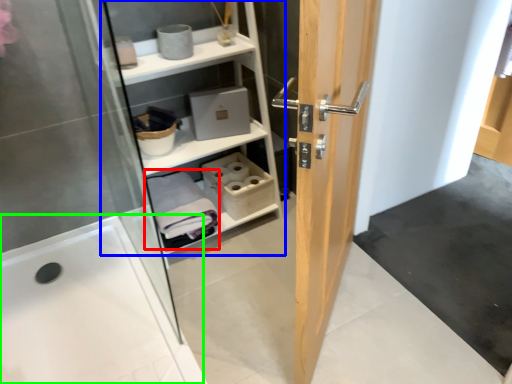
Question: Estimate the real-world distances between objects in this image. Which object is farther from bath towel (highlighted by a red box), shelf (highlighted by a blue box) or bath (highlighted by a green box)?

Choices:
 (A) shelf
 (B) bath

Answer: (B)